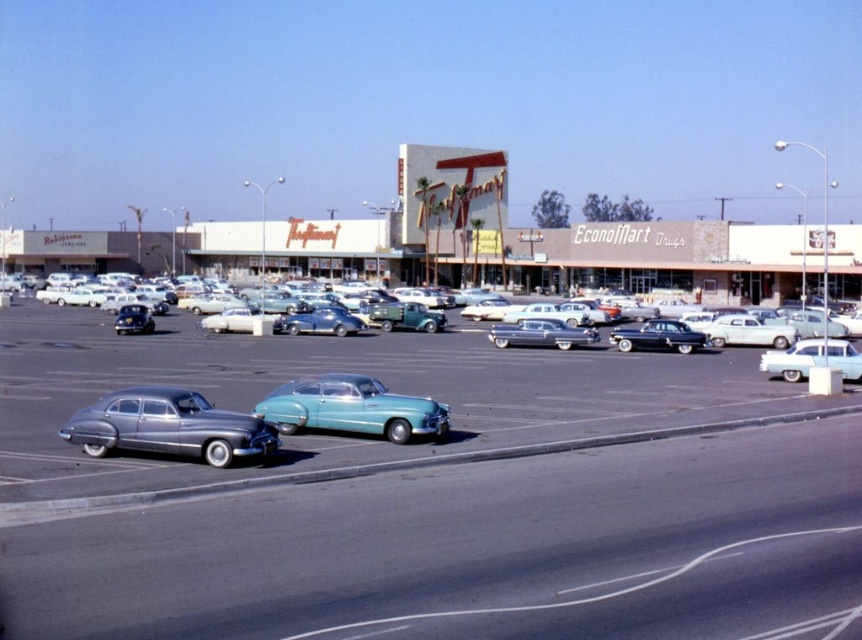
In the scene shown: Can you confirm if metallic blue sedan at center is shorter than glossy black sedan at center?

Correct, metallic blue sedan at center is not as tall as glossy black sedan at center.

Can you confirm if metallic blue sedan at center is positioned below glossy black sedan at center?

Yes.

Is point (497, 339) farther from viewer compared to point (694, 348)?

Yes.

What are the coordinates of `metallic blue sedan at center` in the screenshot? It's located at (541, 333).

Does metallic silver sedan at lower left lie in front of glossy black sedan at center?

Yes, metallic silver sedan at lower left is closer to the viewer.

Does metallic silver sedan at lower left have a lesser height compared to glossy black sedan at center?

Correct, metallic silver sedan at lower left is not as tall as glossy black sedan at center.

Identify the location of metallic silver sedan at lower left. (167, 426).

Consider the image. Who is more distant from viewer, [523,268] or [280,392]?

Point [523,268]

Between beige concrete building at center and teal glossy sedan at center, which one is positioned lower?

teal glossy sedan at center is below.

I want to click on beige concrete building at center, so click(478, 248).